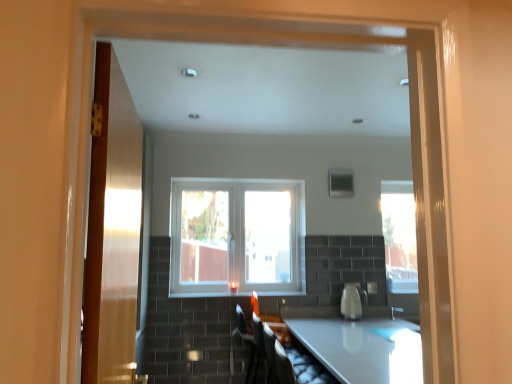
You are a GUI agent. You are given a task and a screenshot of the screen. Output one action in this format:
    pyautogui.click(x=<x>, y=<y>)
    Task: Click on the white glossy countertop at center
    This screenshot has height=384, width=512.
    Given the screenshot: What is the action you would take?
    pyautogui.click(x=359, y=344)

Describe the element at coordinates (237, 236) in the screenshot. The width and height of the screenshot is (512, 384). I see `white plastic window at center` at that location.

What is the approximate height of white glossy kettle at center?

10.14 inches.

You are a GUI agent. You are given a task and a screenshot of the screen. Output one action in this format:
    pyautogui.click(x=<x>, y=<y>)
    Task: Click on the white glossy kettle at center
    
    Given the screenshot: What is the action you would take?
    pyautogui.click(x=352, y=301)

The image size is (512, 384). What are the coordinates of `white glossy countertop at center` in the screenshot? It's located at (359, 344).

From the picture: Would you consider white plastic window at center to be distant from matte black armchair at lower center, which is the first armchair from front to back?

white plastic window at center is far away from matte black armchair at lower center, which is the first armchair from front to back.

Does white plastic window at center appear on the right side of matte black armchair at lower center, which is the first armchair from front to back?

In fact, white plastic window at center is to the left of matte black armchair at lower center, which is the first armchair from front to back.

How many degrees apart are the facing directions of white plastic window at center and matte black armchair at lower center, marked as the 2th armchair in a back-to-front arrangement?

90 degrees separate the facing orientations of white plastic window at center and matte black armchair at lower center, marked as the 2th armchair in a back-to-front arrangement.

Is white plastic window at center in front of or behind matte black armchair at lower center, which is the first armchair from front to back, in the image?

Visually, white plastic window at center is located behind matte black armchair at lower center, which is the first armchair from front to back.

Can you confirm if matte black armchair at lower center, which appears as the 1th armchair when viewed from the back, is bigger than white glossy kettle at center?

Yes, matte black armchair at lower center, which appears as the 1th armchair when viewed from the back, is bigger than white glossy kettle at center.

From the image's perspective, count 2nd armchairs downward from the white glossy kettle at center and point to it. Please provide its 2D coordinates.

[(277, 327)]

From a real-world perspective, does matte black armchair at lower center, which appears as the 1th armchair when viewed from the back, sit lower than white glossy kettle at center?

Correct, in the physical world, matte black armchair at lower center, which appears as the 1th armchair when viewed from the back, is lower than white glossy kettle at center.

Could you tell me if matte black armchair at lower center, which is the 2th armchair from front to back, is facing white glossy kettle at center?

Yes, matte black armchair at lower center, which is the 2th armchair from front to back, faces towards white glossy kettle at center.

Which is more to the right, matte black armchair at lower center, marked as the 2th armchair in a back-to-front arrangement, or matte black armchair at lower center, which is the 2th armchair from front to back?

matte black armchair at lower center, marked as the 2th armchair in a back-to-front arrangement.

From a real-world perspective, which is physically above, matte black armchair at lower center, marked as the 2th armchair in a back-to-front arrangement, or matte black armchair at lower center, which appears as the 1th armchair when viewed from the back?

matte black armchair at lower center, marked as the 2th armchair in a back-to-front arrangement, from a real-world perspective.

In the scene shown: Measure the distance between matte black armchair at lower center, marked as the 2th armchair in a back-to-front arrangement, and matte black armchair at lower center, which is the 2th armchair from front to back.

matte black armchair at lower center, marked as the 2th armchair in a back-to-front arrangement, and matte black armchair at lower center, which is the 2th armchair from front to back, are 20.63 inches apart from each other.

From their relative heights in the image, would you say matte black armchair at lower center, marked as the 2th armchair in a back-to-front arrangement, is taller or shorter than matte black armchair at lower center, which is the 2th armchair from front to back?

Considering their sizes, matte black armchair at lower center, marked as the 2th armchair in a back-to-front arrangement, has less height than matte black armchair at lower center, which is the 2th armchair from front to back.

From the image's perspective, between white plastic window at center and matte black armchair at lower center, which appears as the 1th armchair when viewed from the back, which one is located above?

white plastic window at center appears higher in the image.

Which of these two, white plastic window at center or matte black armchair at lower center, which is the 2th armchair from front to back, stands shorter?

With less height is matte black armchair at lower center, which is the 2th armchair from front to back.

From the picture: Is white plastic window at center looking in the opposite direction of matte black armchair at lower center, which appears as the 1th armchair when viewed from the back?

No.

Is white glossy kettle at center far away from white plastic window at center?

They are positioned close to each other.

Which is behind, white glossy kettle at center or white plastic window at center?

white plastic window at center is behind.

Is white glossy kettle at center at the right side of white plastic window at center?

Indeed, white glossy kettle at center is positioned on the right side of white plastic window at center.

From the image's perspective, is white glossy kettle at center located beneath white plastic window at center?

Correct, white glossy kettle at center appears lower than white plastic window at center in the image.

Which of these two, wooden door at left or matte black armchair at lower center, which is the first armchair from front to back, stands taller?

wooden door at left.

From a real-world perspective, relative to matte black armchair at lower center, which is the first armchair from front to back, is wooden door at left vertically above or below?

From a real-world perspective, wooden door at left is physically above matte black armchair at lower center, which is the first armchair from front to back.

Is there a large distance between wooden door at left and matte black armchair at lower center, marked as the 2th armchair in a back-to-front arrangement?

Yes, wooden door at left and matte black armchair at lower center, marked as the 2th armchair in a back-to-front arrangement, are quite far apart.

Which of these two, wooden door at left or matte black armchair at lower center, which is the first armchair from front to back, is wider?

With larger width is matte black armchair at lower center, which is the first armchair from front to back.

Which is behind, wooden door at left or matte black armchair at lower center, which appears as the 1th armchair when viewed from the back?

matte black armchair at lower center, which appears as the 1th armchair when viewed from the back, is behind.

Which armchair is the 2nd one when counting from the back of the wooden door at left? Please provide its 2D coordinates.

[(277, 327)]

Is wooden door at left at the right side of matte black armchair at lower center, which is the 2th armchair from front to back?

No, wooden door at left is not to the right of matte black armchair at lower center, which is the 2th armchair from front to back.

Find the location of a particular element. The height and width of the screenshot is (384, 512). armchair that is the 1st object located below the white plastic window at center (from the image's perspective) is located at coordinates (295, 363).

From the white glossy kettle at center, count 1st armchairs forward and point to it. Please provide its 2D coordinates.

[(277, 327)]

From the image, which object appears to be nearer to matte black armchair at lower center, which appears as the 1th armchair when viewed from the back, wooden door at left or white glossy countertop at center?

white glossy countertop at center is positioned closer to the anchor matte black armchair at lower center, which appears as the 1th armchair when viewed from the back.

Looking at the image, which one is located closer to white plastic window at center, matte black armchair at lower center, which appears as the 1th armchair when viewed from the back, or white glossy countertop at center?

matte black armchair at lower center, which appears as the 1th armchair when viewed from the back, is closer to white plastic window at center.

From the image, which object appears to be nearer to white glossy kettle at center, wooden door at left or white glossy countertop at center?

white glossy countertop at center lies closer to white glossy kettle at center than the other object.

Estimate the real-world distances between objects in this image. Which object is closer to white glossy countertop at center, wooden door at left or white glossy kettle at center?

Based on the image, white glossy kettle at center appears to be nearer to white glossy countertop at center.

Based on their spatial positions, is matte black armchair at lower center, which is the 2th armchair from front to back, or white plastic window at center further from white glossy kettle at center?

white plastic window at center lies further to white glossy kettle at center than the other object.

When comparing their distances from matte black armchair at lower center, marked as the 2th armchair in a back-to-front arrangement, does matte black armchair at lower center, which is the 2th armchair from front to back, or wooden door at left seem closer?

The object closer to matte black armchair at lower center, marked as the 2th armchair in a back-to-front arrangement, is matte black armchair at lower center, which is the 2th armchair from front to back.

Which object lies nearer to the anchor point matte black armchair at lower center, which is the 2th armchair from front to back, white glossy countertop at center or wooden door at left?

white glossy countertop at center.

From the image, which object appears to be nearer to white glossy kettle at center, matte black armchair at lower center, marked as the 2th armchair in a back-to-front arrangement, or wooden door at left?

The object closer to white glossy kettle at center is matte black armchair at lower center, marked as the 2th armchair in a back-to-front arrangement.

Image resolution: width=512 pixels, height=384 pixels. Identify the location of appliance located between white glossy countertop at center and white plastic window at center in the depth direction. (352, 301).

You are a GUI agent. You are given a task and a screenshot of the screen. Output one action in this format:
    pyautogui.click(x=<x>, y=<y>)
    Task: Click on the countertop located between wooden door at left and white plastic window at center in the depth direction
    The width and height of the screenshot is (512, 384).
    Given the screenshot: What is the action you would take?
    pyautogui.click(x=359, y=344)

Find the location of a particular element. The width and height of the screenshot is (512, 384). armchair positioned between matte black armchair at lower center, marked as the 2th armchair in a back-to-front arrangement, and white glossy kettle at center from near to far is located at coordinates (277, 327).

You are a GUI agent. You are given a task and a screenshot of the screen. Output one action in this format:
    pyautogui.click(x=<x>, y=<y>)
    Task: Click on the armchair between matte black armchair at lower center, marked as the 2th armchair in a back-to-front arrangement, and white plastic window at center from front to back
    Image resolution: width=512 pixels, height=384 pixels.
    Given the screenshot: What is the action you would take?
    pyautogui.click(x=277, y=327)